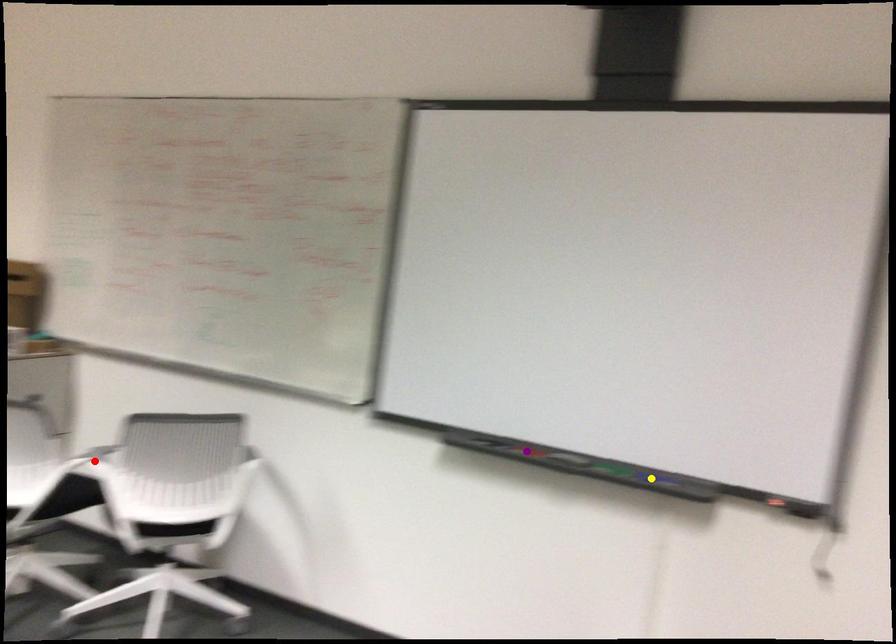
In the scene shown: Order these from nearest to farthest:
1. yellow point
2. red point
3. purple point

yellow point < purple point < red point